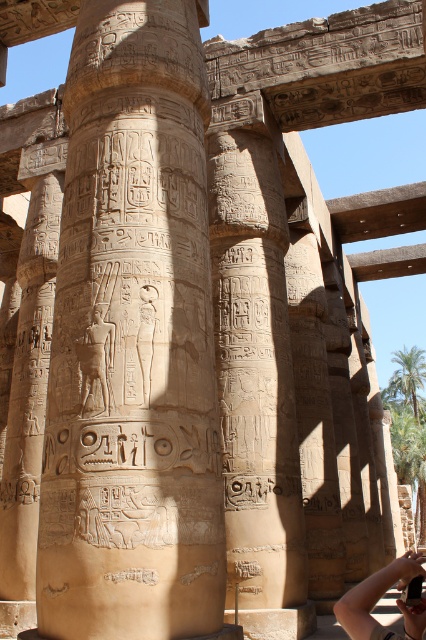
Is beige stone column at center to the left of skin-toned hand holding camera at center from the viewer's perspective?

Indeed, beige stone column at center is positioned on the left side of skin-toned hand holding camera at center.

Can you confirm if beige stone column at center is positioned to the right of skin-toned hand holding camera at center?

In fact, beige stone column at center is to the left of skin-toned hand holding camera at center.

Which is behind, point (85, 593) or point (400, 570)?

The point (85, 593) is more distant.

This screenshot has width=426, height=640. In order to click on beige stone column at center in this screenshot , I will do `click(132, 340)`.

Based on the photo, between carved stone column at center and skin-toned hand holding camera at center, which one has more height?

carved stone column at center is taller.

In order to click on carved stone column at center in this screenshot , I will do `click(256, 378)`.

Locate an element on the screen. carved stone column at center is located at coordinates (256, 378).

From the picture: Does beige stone column at center have a smaller size compared to carved stone column at center?

No.

Based on the photo, is beige stone column at center closer to the viewer compared to carved stone column at center?

Yes, it is.

Is point (207, 340) closer to viewer compared to point (262, 545)?

Yes.

At what (x,y) coordinates should I click in order to perform the action: click on beige stone column at center. Please return your answer as a coordinate pair (x, y). The width and height of the screenshot is (426, 640). Looking at the image, I should click on (132, 340).